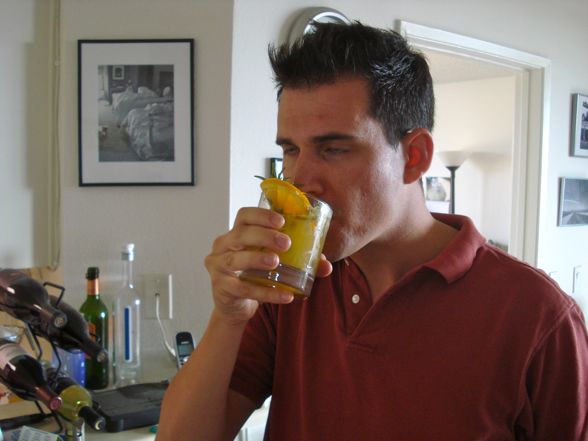
Locate an element on the screen. This screenshot has height=441, width=588. frame is located at coordinates (583, 120), (569, 183), (584, 281), (118, 121).